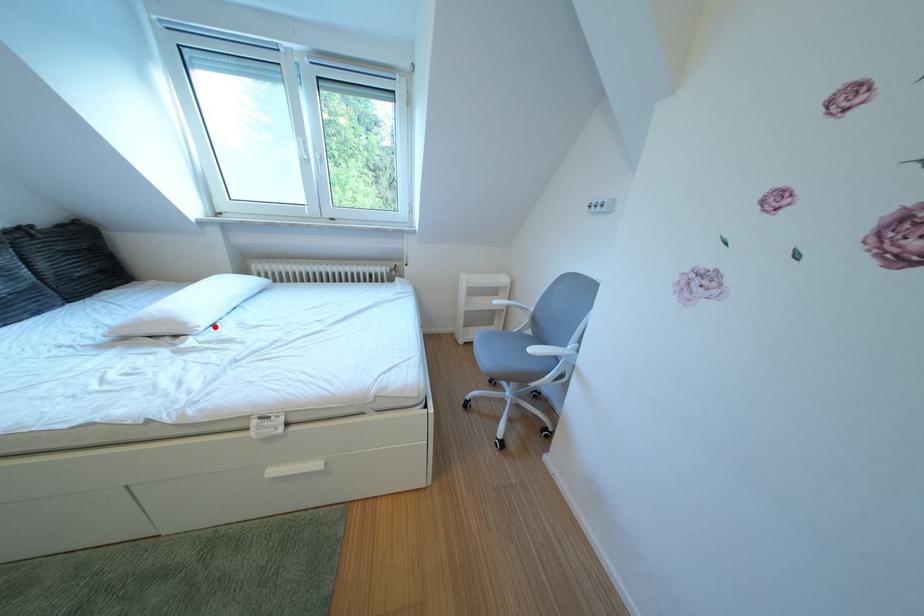
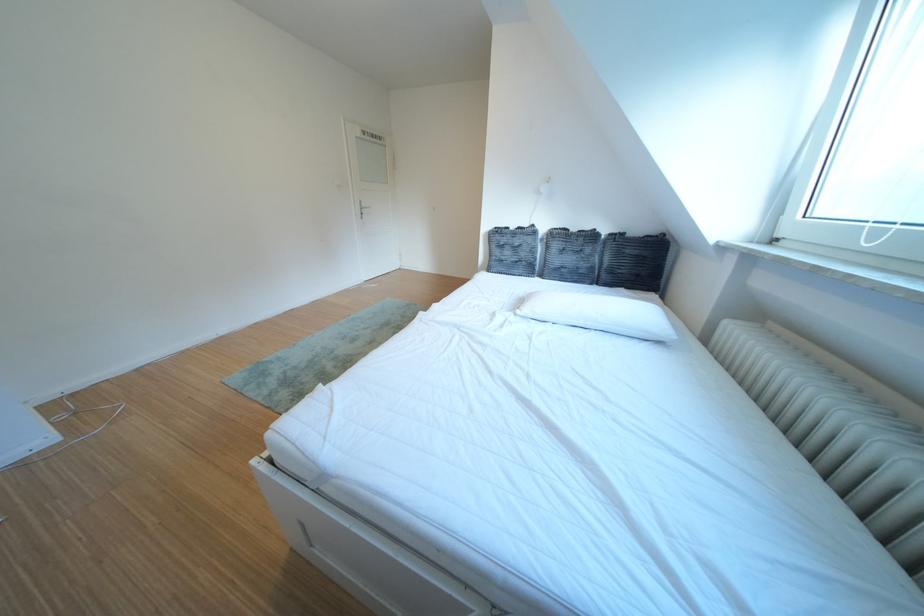
In the second image, find the point that corresponds to the highlighted location in the first image.

(540, 314)